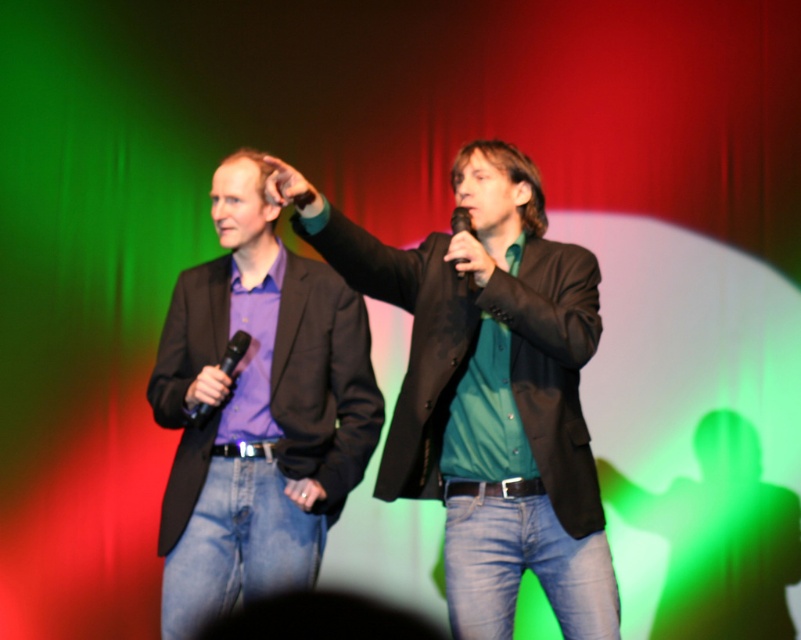
Does green matte shirt at center lie behind black matte microphone at upper center?

No, green matte shirt at center is in front of black matte microphone at upper center.

Is point (524, 337) positioned before point (469, 214)?

Yes, it is in front of point (469, 214).

Describe the element at coordinates (488, 388) in the screenshot. I see `green matte shirt at center` at that location.

Where is `green matte shirt at center`? This screenshot has height=640, width=801. green matte shirt at center is located at coordinates (488, 388).

Does green matte shirt at center appear over purple matte shirt at left?

No, green matte shirt at center is not above purple matte shirt at left.

Can you confirm if green matte shirt at center is thinner than purple matte shirt at left?

Incorrect, green matte shirt at center's width is not less than purple matte shirt at left's.

Image resolution: width=801 pixels, height=640 pixels. What do you see at coordinates (488, 388) in the screenshot?
I see `green matte shirt at center` at bounding box center [488, 388].

At what (x,y) coordinates should I click in order to perform the action: click on green matte shirt at center. Please return your answer as a coordinate pair (x, y). Looking at the image, I should click on (488, 388).

Measure the distance between purple matte shirt at left and black matte microphone at upper center.

A distance of 29.96 inches exists between purple matte shirt at left and black matte microphone at upper center.

Between point (298, 451) and point (463, 225), which one is positioned behind?

The point (298, 451) is more distant.

Is point (276, 264) positioned before point (457, 216)?

No.

I want to click on purple matte shirt at left, so click(256, 410).